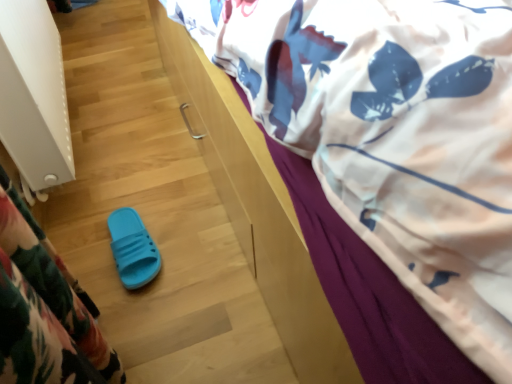
Question: Can you confirm if white textured radiator at left is positioned to the left of blue rubber slipper at lower left?

Choices:
 (A) no
 (B) yes

Answer: (B)

Question: Does white textured radiator at left have a lesser width compared to blue rubber slipper at lower left?

Choices:
 (A) no
 (B) yes

Answer: (A)

Question: Considering the relative sizes of white textured radiator at left and blue rubber slipper at lower left in the image provided, is white textured radiator at left bigger than blue rubber slipper at lower left?

Choices:
 (A) no
 (B) yes

Answer: (B)

Question: From a real-world perspective, is white textured radiator at left physically above blue rubber slipper at lower left?

Choices:
 (A) no
 (B) yes

Answer: (B)

Question: Is white textured radiator at left shorter than blue rubber slipper at lower left?

Choices:
 (A) yes
 (B) no

Answer: (B)

Question: From the image's perspective, is white textured radiator at left on blue rubber slipper at lower left?

Choices:
 (A) yes
 (B) no

Answer: (A)

Question: Considering the relative sizes of blue rubber slipper at lower left and white printed fabric at upper right in the image provided, is blue rubber slipper at lower left wider than white printed fabric at upper right?

Choices:
 (A) no
 (B) yes

Answer: (A)

Question: Considering the relative positions of blue rubber slipper at lower left and white printed fabric at upper right in the image provided, is blue rubber slipper at lower left behind white printed fabric at upper right?

Choices:
 (A) no
 (B) yes

Answer: (B)

Question: Is blue rubber slipper at lower left aimed at white printed fabric at upper right?

Choices:
 (A) yes
 (B) no

Answer: (B)

Question: From a real-world perspective, is blue rubber slipper at lower left over white printed fabric at upper right?

Choices:
 (A) no
 (B) yes

Answer: (A)

Question: Is blue rubber slipper at lower left positioned beyond the bounds of white printed fabric at upper right?

Choices:
 (A) yes
 (B) no

Answer: (A)

Question: Considering the relative sizes of blue rubber slipper at lower left and white printed fabric at upper right in the image provided, is blue rubber slipper at lower left shorter than white printed fabric at upper right?

Choices:
 (A) yes
 (B) no

Answer: (A)

Question: Is the position of white textured radiator at left more distant than that of white printed fabric at upper right?

Choices:
 (A) yes
 (B) no

Answer: (A)